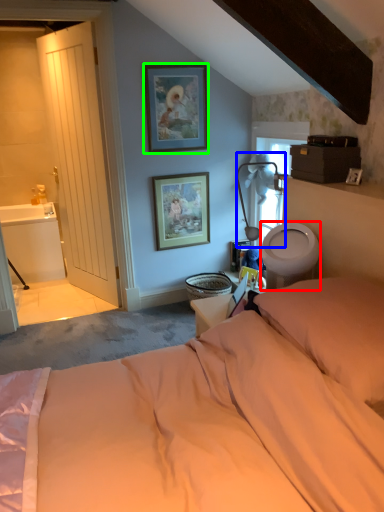
Question: Considering the real-world distances, which object is farthest from toilet bowl (highlighted by a red box)? table lamp (highlighted by a blue box) or picture frame (highlighted by a green box)?

Choices:
 (A) table lamp
 (B) picture frame

Answer: (B)